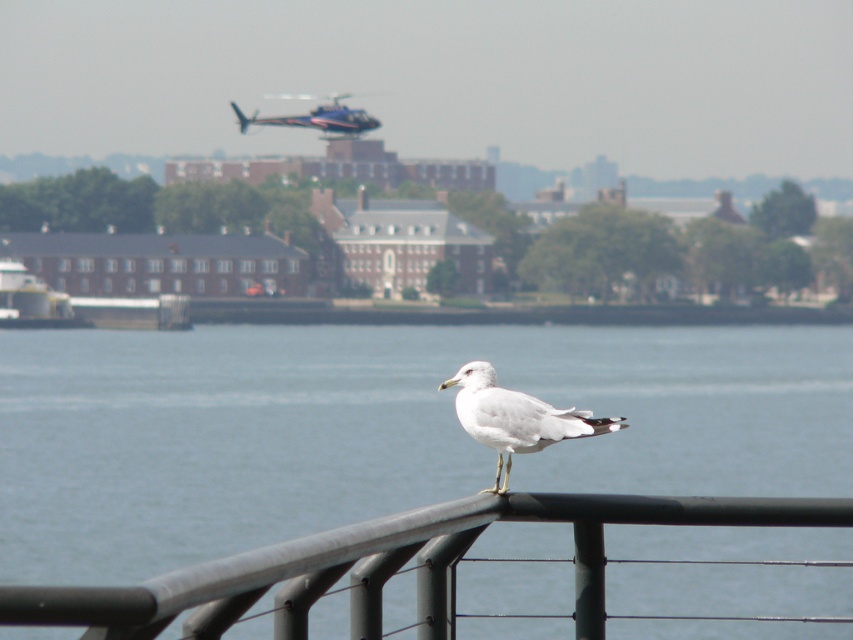
You are standing at the waterfront and want to take a photo that includes both the clear blue water at center and the black metal fence at lower center. Which object will occupy more horizontal space in the photo?

The clear blue water at center will occupy more horizontal space in the photo because its width surpasses that of the black metal fence at lower center.

You are standing at the waterfront and see the clear blue water at center and the black metal fence at lower center. Which object is located to the right side?

The black metal fence at lower center is located to the right of the clear blue water at center.

You are standing at the waterfront and see the black metal fence at lower center and the white feathered bird at center. Which object is closer to you?

The black metal fence at lower center is closer to you because it is positioned in front of the white feathered bird at center.